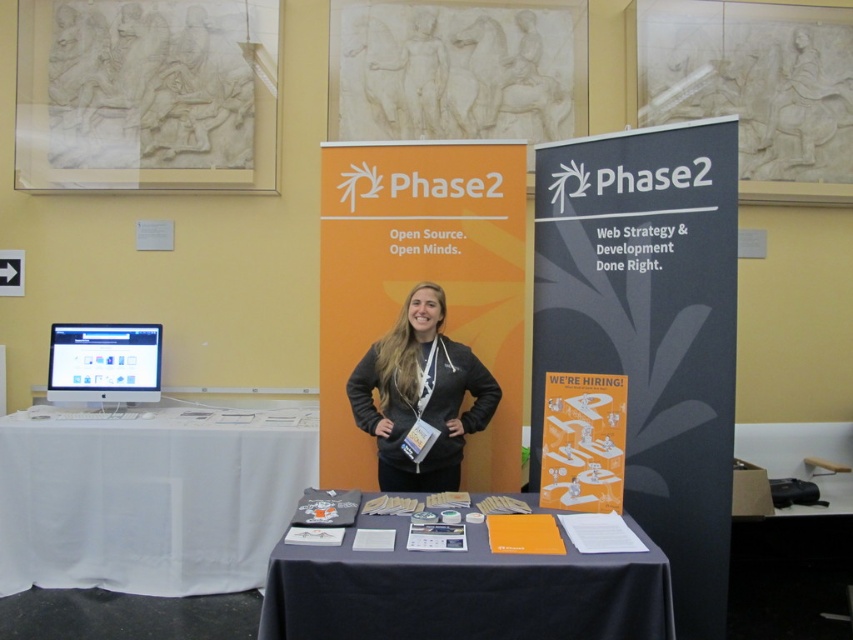
Is orange paper at center to the left of matte silver monitor at left from the viewer's perspective?

Incorrect, orange paper at center is not on the left side of matte silver monitor at left.

This screenshot has height=640, width=853. What are the coordinates of `orange paper at center` in the screenshot? It's located at (463, 589).

Image resolution: width=853 pixels, height=640 pixels. I want to click on orange paper at center, so click(463, 589).

Does dark gray fleece jacket at center have a smaller size compared to matte silver monitor at left?

Incorrect, dark gray fleece jacket at center is not smaller in size than matte silver monitor at left.

Which is more to the right, dark gray fleece jacket at center or matte silver monitor at left?

dark gray fleece jacket at center

Who is more forward, (x=360, y=424) or (x=155, y=368)?

Point (x=360, y=424) is in front.

The image size is (853, 640). What are the coordinates of `dark gray fleece jacket at center` in the screenshot? It's located at (421, 394).

Can you confirm if white cloth-covered table at lower left is taller than orange paper at center?

Indeed, white cloth-covered table at lower left has a greater height compared to orange paper at center.

The width and height of the screenshot is (853, 640). In order to click on white cloth-covered table at lower left in this screenshot , I will do `click(149, 496)`.

You are a GUI agent. You are given a task and a screenshot of the screen. Output one action in this format:
    pyautogui.click(x=<x>, y=<y>)
    Task: Click on the white cloth-covered table at lower left
    
    Given the screenshot: What is the action you would take?
    pyautogui.click(x=149, y=496)